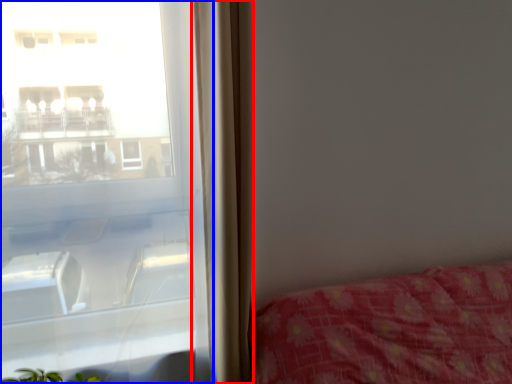
Question: Which point is closer to the camera, curtain (highlighted by a red box) or window (highlighted by a blue box)?

Choices:
 (A) curtain
 (B) window

Answer: (B)